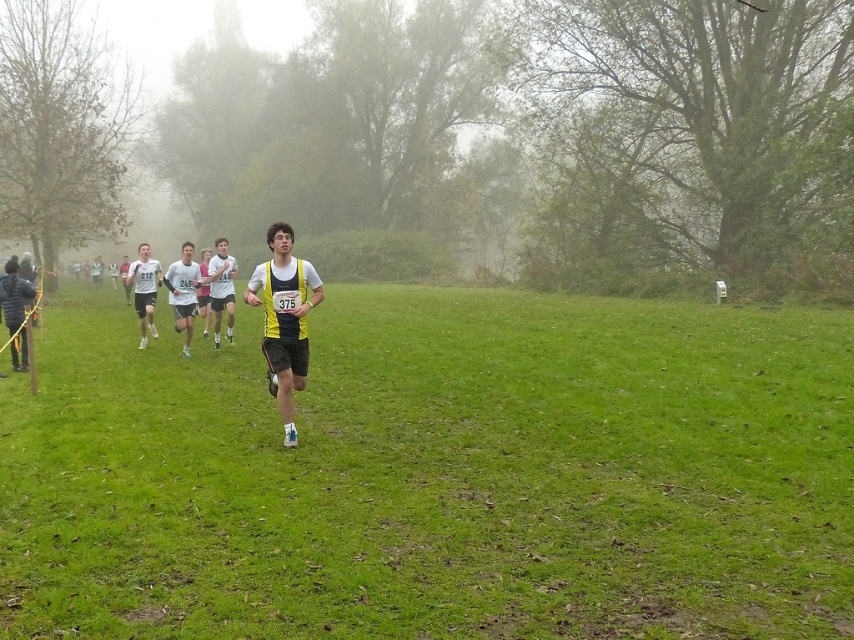
Who is lower down, yellow fabric runner at center or white matte shirt at left?

Positioned lower is yellow fabric runner at center.

Find the location of a particular element. yellow fabric runner at center is located at coordinates (436, 474).

Is point (682, 433) positioned before point (149, 259)?

Yes, point (682, 433) is closer to viewer.

Identify the location of yellow fabric runner at center. (436, 474).

Does white fabric shirt at center appear over white matte shirt at left?

Yes, white fabric shirt at center is above white matte shirt at left.

From the picture: Is white fabric shirt at center to the left of white matte shirt at left from the viewer's perspective?

Incorrect, white fabric shirt at center is not on the left side of white matte shirt at left.

Who is more distant from viewer, (178, 289) or (136, 280)?

Positioned behind is point (136, 280).

Find the location of `white fabric shirt at center`. white fabric shirt at center is located at coordinates (183, 292).

In the scene shown: Can you confirm if yellow fabric runner at center is wider than yellow/black athletic vest at center?

Correct, the width of yellow fabric runner at center exceeds that of yellow/black athletic vest at center.

Which is more to the right, yellow fabric runner at center or yellow/black athletic vest at center?

From the viewer's perspective, yellow fabric runner at center appears more on the right side.

Between point (407, 538) and point (309, 275), which one is positioned in front?

Point (407, 538)

Where is `yellow fabric runner at center`? yellow fabric runner at center is located at coordinates (436, 474).